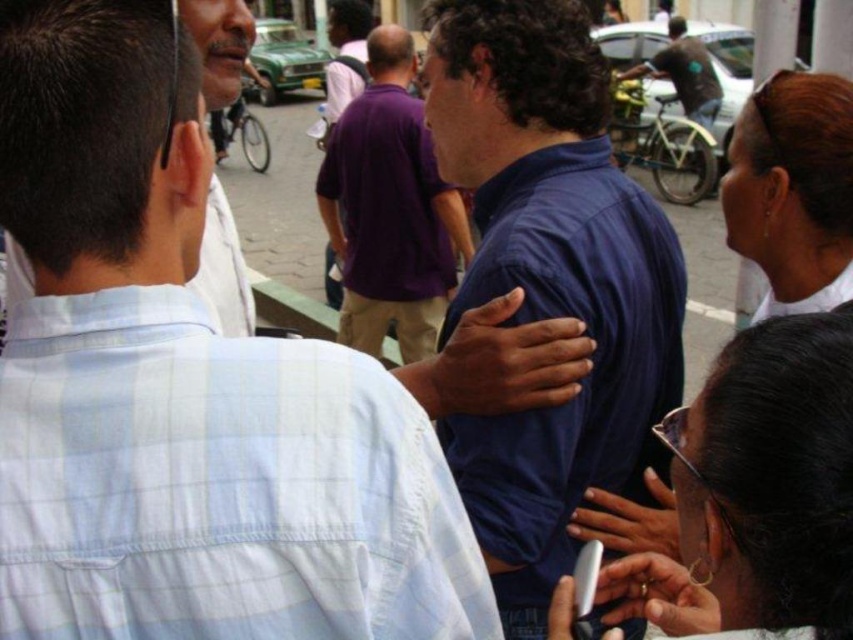
You are a photographer trying to capture a clear shot of the blue cotton shirt at center and the light blue plaid shirt at upper left. Which shirt should you focus on first if you want to ensure both are in frame and the larger one is properly centered?

You should focus on the blue cotton shirt at center first because it is larger than the light blue plaid shirt at upper left, so centering it ensures both shirts will fit within the frame.

You are a photographer trying to capture a photo of the blue cotton shirt at center and the light blue plaid shirt at upper left. Based on their positions, which shirt should you focus on first to ensure both are in the frame?

The blue cotton shirt at center is wider than the light blue plaid shirt at upper left, so you should focus on the blue cotton shirt at center first to ensure it fits within the frame.

You are a photographer standing in the middle of the street. You want to take a photo of the blue shirt at center and dark blue shirt at upper right. Which one should you focus on first to ensure both are in focus?

You should focus on the blue shirt at center first since it is closer to the viewer, so adjusting focus from it to the dark blue shirt at upper right will help both be in focus.